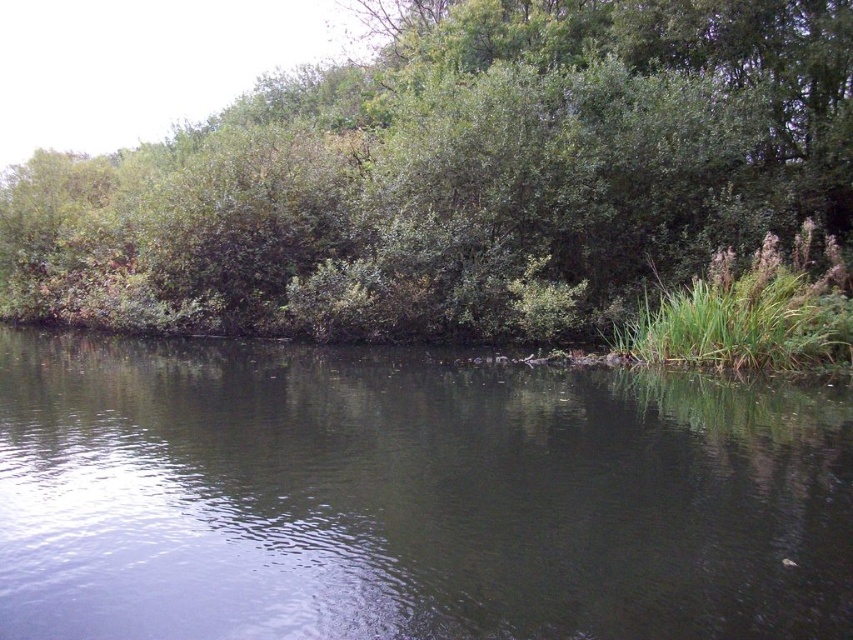
Does greenish-gray water at center have a greater height compared to green leafy bush at upper center?

In fact, greenish-gray water at center may be shorter than green leafy bush at upper center.

Is point (223, 474) more distant than point (468, 243)?

No.

Locate an element on the screen. The height and width of the screenshot is (640, 853). greenish-gray water at center is located at coordinates (409, 499).